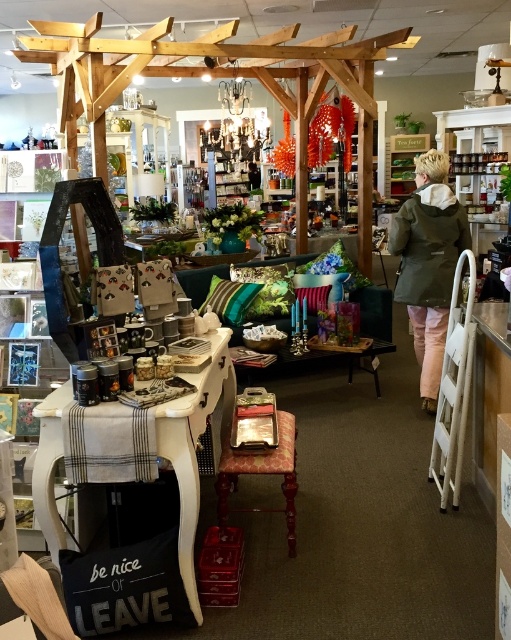
You are a customer in the store and want to pick up both the green matte jacket at upper right and the wooden stool at center. Which item should you reach for first to grab both efficiently?

You should reach for the green matte jacket at upper right first because it is closer to you than the wooden stool at center. After picking it up, you can then easily reach the wooden stool at center.

You are a customer in the store and want to reach the green matte jacket at upper right displayed at point (429,262). The store has a clearance policy where items priced under 20 dollars are placed below 0.5 on the y axis. Is the green matte jacket at upper right eligible for clearance?

The green matte jacket at upper right is located at point (429,262). Since the y coordinate is above 0.5, it is placed above the clearance threshold, so it is not eligible for clearance.